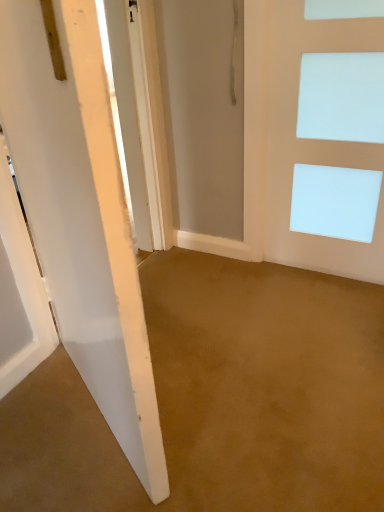
Question: Considering the positions of white matte door at center, the 1th door from the left, and white matte door at right, the second door viewed from the left, in the image, is white matte door at center, the 1th door from the left, wider or thinner than white matte door at right, the second door viewed from the left,?

Choices:
 (A) thin
 (B) wide

Answer: (B)

Question: Based on their positions, is white matte door at center, the 1th door from the left, located to the left or right of white matte door at right, which is the 1th door from right to left?

Choices:
 (A) right
 (B) left

Answer: (B)

Question: From the image's perspective, is white matte door at center, the 1th door from the left, positioned above or below white matte door at right, the second door viewed from the left?

Choices:
 (A) below
 (B) above

Answer: (A)

Question: Would you say white matte door at right, which is the 1th door from right to left, is to the left or to the right of white matte door at center, the 1th door from the left, in the picture?

Choices:
 (A) right
 (B) left

Answer: (A)

Question: Considering the positions of point (271, 248) and point (66, 244), is point (271, 248) closer or farther from the camera than point (66, 244)?

Choices:
 (A) closer
 (B) farther

Answer: (B)

Question: Based on their sizes in the image, would you say white matte door at right, which is the 1th door from right to left, is bigger or smaller than white matte door at center, the 1th door from the left?

Choices:
 (A) big
 (B) small

Answer: (B)

Question: From the image's perspective, is white matte door at right, the second door viewed from the left, positioned above or below white matte door at center, the 1th door from the left?

Choices:
 (A) below
 (B) above

Answer: (B)